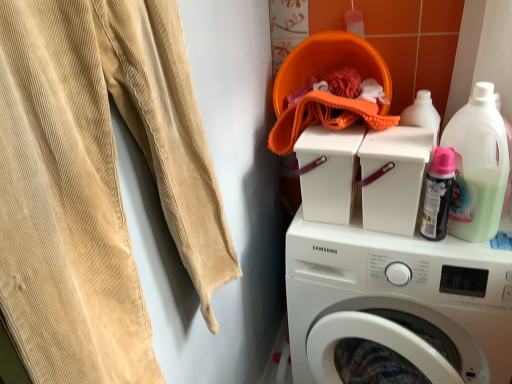
Describe the element at coordinates (394, 177) in the screenshot. The image size is (512, 384). I see `white plastic container at center` at that location.

What do you see at coordinates (97, 183) in the screenshot? Image resolution: width=512 pixels, height=384 pixels. I see `beige corduroy sweat pants at left` at bounding box center [97, 183].

Looking at this image, in order to face matte black spray can at upper right, should I rotate leftwards or rightwards?

Turn right by 23.688 degrees to look at matte black spray can at upper right.

What are the coordinates of `translucent plastic detergent at upper right` in the screenshot? It's located at (477, 166).

Can you confirm if white plastic container at center is thinner than white plastic washing machine at upper right, arranged as the first washing machine when ordered from the bottom?

Yes.

Is white plastic container at center not close to white plastic washing machine at upper right, acting as the 2th washing machine starting from the top?

white plastic container at center is near white plastic washing machine at upper right, acting as the 2th washing machine starting from the top, not far away.

Locate an element on the screen. appliance located above the white plastic washing machine at upper right, arranged as the first washing machine when ordered from the bottom (from the image's perspective) is located at coordinates (394, 177).

Can you confirm if beige corduroy sweat pants at left is positioned to the right of matte black spray can at upper right?

No.

What's the angular difference between beige corduroy sweat pants at left and matte black spray can at upper right's facing directions?

The angular difference between beige corduroy sweat pants at left and matte black spray can at upper right is 0.000372 degrees.

From a real-world perspective, is beige corduroy sweat pants at left located higher than matte black spray can at upper right?

Yes, from a real-world perspective, beige corduroy sweat pants at left is on top of matte black spray can at upper right.

From a real-world perspective, which is physically below, matte black spray can at upper right or beige corduroy sweat pants at left?

matte black spray can at upper right.

Is matte black spray can at upper right directly adjacent to beige corduroy sweat pants at left?

There is a gap between matte black spray can at upper right and beige corduroy sweat pants at left.

From the image's perspective, is matte black spray can at upper right positioned above or below beige corduroy sweat pants at left?

matte black spray can at upper right is situated higher than beige corduroy sweat pants at left in the image.

Is matte black spray can at upper right positioned with its back to beige corduroy sweat pants at left?

matte black spray can at upper right does not have its back to beige corduroy sweat pants at left.

Based on their sizes in the image, would you say translucent plastic detergent at upper right is bigger or smaller than matte black spray can at upper right?

In the image, translucent plastic detergent at upper right appears to be larger than matte black spray can at upper right.

Consider the image. From a real-world perspective, who is located higher, translucent plastic detergent at upper right or matte black spray can at upper right?

In real-world perspective, translucent plastic detergent at upper right is above.

Locate an element on the screen. Image resolution: width=512 pixels, height=384 pixels. cleaning product on the right of the matte black spray can at upper right is located at coordinates (477, 166).

Is translucent plastic detergent at upper right shorter than matte black spray can at upper right?

In fact, translucent plastic detergent at upper right may be taller than matte black spray can at upper right.

Is white plastic washing machine at upper right, arranged as the first washing machine when ordered from the bottom, far away from matte black spray can at upper right?

No, white plastic washing machine at upper right, arranged as the first washing machine when ordered from the bottom, is not far from matte black spray can at upper right.

Is white plastic washing machine at upper right, acting as the 2th washing machine starting from the top, inside the boundaries of matte black spray can at upper right, or outside?

white plastic washing machine at upper right, acting as the 2th washing machine starting from the top, is located beyond the bounds of matte black spray can at upper right.

Does white plastic washing machine at upper right, acting as the 2th washing machine starting from the top, have a lesser width compared to matte black spray can at upper right?

No.

Consider the image. Which object is further away from the camera, white plastic washing machine at upper right, arranged as the first washing machine when ordered from the bottom, or matte black spray can at upper right?

matte black spray can at upper right.

From a real-world perspective, is translucent plastic detergent at upper right positioned above or below beige corduroy sweat pants at left?

translucent plastic detergent at upper right is situated lower than beige corduroy sweat pants at left in the real world.

You are a GUI agent. You are given a task and a screenshot of the screen. Output one action in this format:
    pyautogui.click(x=<x>, y=<y>)
    Task: Click on the sweat pant that is in front of the translucent plastic detergent at upper right
    The image size is (512, 384).
    Given the screenshot: What is the action you would take?
    pyautogui.click(x=97, y=183)

Is translucent plastic detergent at upper right wider than beige corduroy sweat pants at left?

No, translucent plastic detergent at upper right is not wider than beige corduroy sweat pants at left.

Based on the photo, is beige corduroy sweat pants at left a part of translucent plastic detergent at upper right?

That's incorrect, beige corduroy sweat pants at left is not inside translucent plastic detergent at upper right.

I want to click on bottle on the right of white plastic container at center, so click(x=438, y=194).

Which of these two, white plastic container at center or matte black spray can at upper right, is thinner?

Thinner between the two is matte black spray can at upper right.

Is there a large distance between white plastic container at center and matte black spray can at upper right?

That's not correct — white plastic container at center is a little close to matte black spray can at upper right.

From a real-world perspective, which object stands above the other?

In real-world perspective, matte black spray can at upper right is above.

You are a GUI agent. You are given a task and a screenshot of the screen. Output one action in this format:
    pyautogui.click(x=<x>, y=<y>)
    Task: Click on the appliance above the white plastic washing machine at upper right, acting as the 2th washing machine starting from the top (from the image's perspective)
    Image resolution: width=512 pixels, height=384 pixels.
    Given the screenshot: What is the action you would take?
    pyautogui.click(x=394, y=177)

The image size is (512, 384). Identify the location of sweat pant on the left of matte black spray can at upper right. (97, 183).

Considering their positions, is translucent plastic detergent at upper right positioned closer to white plastic washing machine at upper right, acting as the 2th washing machine starting from the top, than white plastic washing machine at center, acting as the 2th washing machine starting from the bottom?

The object closer to white plastic washing machine at upper right, acting as the 2th washing machine starting from the top, is white plastic washing machine at center, acting as the 2th washing machine starting from the bottom.

Estimate the real-world distances between objects in this image. Which object is further from matte black spray can at upper right, translucent plastic detergent at upper right or beige corduroy sweat pants at left?

Based on the image, beige corduroy sweat pants at left appears to be further to matte black spray can at upper right.

From the picture: Which object lies nearer to the anchor point white plastic container at center, translucent plastic detergent at upper right or beige corduroy sweat pants at left?

translucent plastic detergent at upper right.

Estimate the real-world distances between objects in this image. Which object is further from beige corduroy sweat pants at left, white plastic washing machine at upper right, acting as the 2th washing machine starting from the top, or white plastic container at center?

Among the two, white plastic container at center is located further to beige corduroy sweat pants at left.

Considering their positions, is translucent plastic detergent at upper right positioned closer to white plastic container at center than matte black spray can at upper right?

Among the two, matte black spray can at upper right is located nearer to white plastic container at center.

From the image, which object appears to be nearer to white plastic washing machine at upper right, acting as the 2th washing machine starting from the top, white plastic container at center or white plastic washing machine at center, acting as the 2th washing machine starting from the bottom?

white plastic container at center lies closer to white plastic washing machine at upper right, acting as the 2th washing machine starting from the top, than the other object.

Considering their positions, is white plastic washing machine at center, the 1th washing machine positioned from the top, positioned further to matte black spray can at upper right than white plastic washing machine at upper right, arranged as the first washing machine when ordered from the bottom?

Based on the image, white plastic washing machine at upper right, arranged as the first washing machine when ordered from the bottom, appears to be further to matte black spray can at upper right.

When comparing their distances from white plastic washing machine at center, the 1th washing machine positioned from the top, does white plastic container at center or white plastic washing machine at upper right, arranged as the first washing machine when ordered from the bottom, seem closer?

Among the two, white plastic container at center is located nearer to white plastic washing machine at center, the 1th washing machine positioned from the top.

In order to click on bottle that lies between white plastic container at center and white plastic washing machine at upper right, acting as the 2th washing machine starting from the top, from top to bottom in this screenshot , I will do `click(438, 194)`.

Where is `appliance between translucent plastic detergent at upper right and white plastic washing machine at upper right, acting as the 2th washing machine starting from the top, from top to bottom`? The height and width of the screenshot is (384, 512). appliance between translucent plastic detergent at upper right and white plastic washing machine at upper right, acting as the 2th washing machine starting from the top, from top to bottom is located at coordinates (394, 177).

Identify the location of bottle between beige corduroy sweat pants at left and white plastic washing machine at upper right, acting as the 2th washing machine starting from the top, in the horizontal direction. Image resolution: width=512 pixels, height=384 pixels. (438, 194).

Find the location of `appliance between white plastic washing machine at center, the 1th washing machine positioned from the top, and white plastic washing machine at upper right, acting as the 2th washing machine starting from the top, in the up-down direction`. appliance between white plastic washing machine at center, the 1th washing machine positioned from the top, and white plastic washing machine at upper right, acting as the 2th washing machine starting from the top, in the up-down direction is located at coordinates (394, 177).